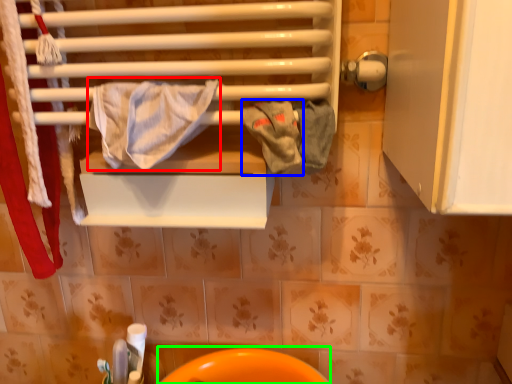
Question: Which object is the farthest from bath towel (highlighted by a red box)? Choose among these: bath towel (highlighted by a blue box) or sink (highlighted by a green box).

Choices:
 (A) bath towel
 (B) sink

Answer: (B)